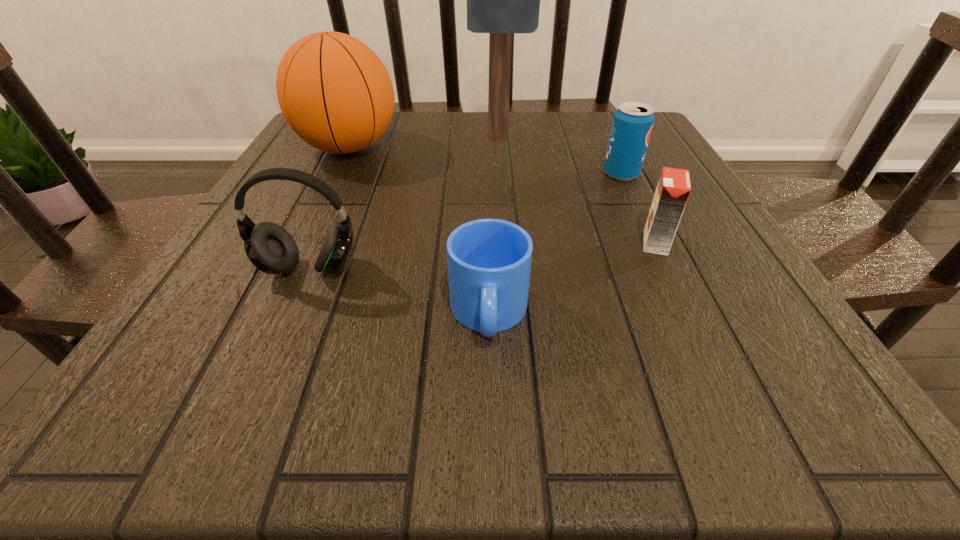
I want to click on free location at the left edge, so click(329, 172).

I want to click on vacant space at the right edge, so click(x=725, y=291).

Find the location of `vacant space at the near right corner of the desktop`. vacant space at the near right corner of the desktop is located at coordinates (761, 383).

Where is `vacant region between the orange juice and the second tallest object`? vacant region between the orange juice and the second tallest object is located at coordinates (502, 195).

Locate an element on the screen. The width and height of the screenshot is (960, 540). unoccupied position between the orange juice and the basketball is located at coordinates (502, 195).

Locate an element on the screen. The image size is (960, 540). vacant area that lies between the basketball and the headset is located at coordinates (328, 208).

I want to click on free space between the soda can and the fourth shortest object, so click(466, 221).

I want to click on free spot between the orange juice and the mallet, so click(x=577, y=191).

Locate an element on the screen. free space between the fifth shortest object and the third tallest object is located at coordinates (328, 208).

The height and width of the screenshot is (540, 960). I want to click on free point between the mallet and the third tallest object, so click(403, 204).